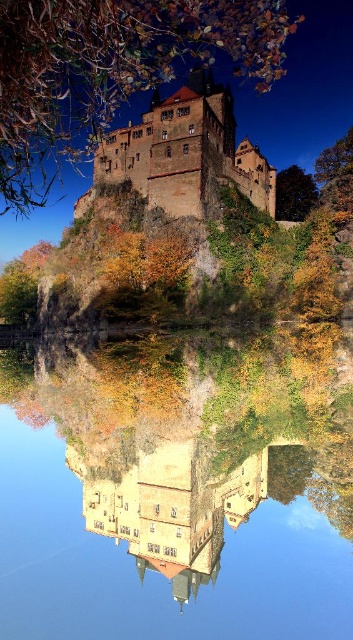
Question: Can you confirm if transparent glass water at center is positioned to the left of brown stone castle at upper center?

Choices:
 (A) no
 (B) yes

Answer: (A)

Question: Among these objects, which one is nearest to the camera?

Choices:
 (A) brown stone castle at upper center
 (B) transparent glass water at center

Answer: (B)

Question: Which point appears closest to the camera in this image?

Choices:
 (A) (337, 616)
 (B) (169, 109)

Answer: (A)

Question: Can you confirm if transparent glass water at center is positioned to the right of brown stone castle at upper center?

Choices:
 (A) yes
 (B) no

Answer: (A)

Question: Is transparent glass water at center to the right of brown stone castle at upper center from the viewer's perspective?

Choices:
 (A) no
 (B) yes

Answer: (B)

Question: Among these objects, which one is nearest to the camera?

Choices:
 (A) transparent glass water at center
 (B) brown stone castle at upper center

Answer: (A)